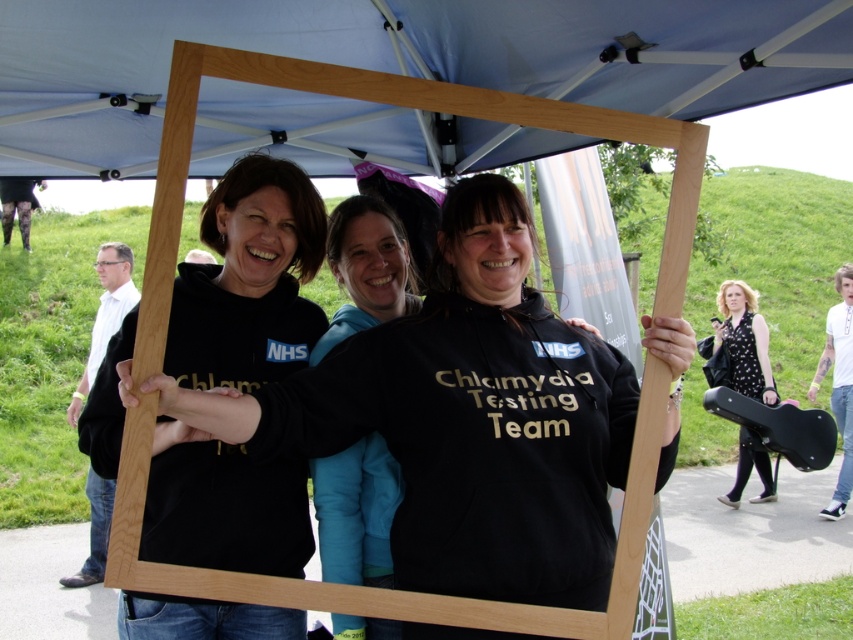
Who is positioned more to the left, matte black hoodie at center or black matte sweatshirt at center?

matte black hoodie at center

Does matte black hoodie at center have a larger size compared to black matte sweatshirt at center?

Yes.

Is point (189, 387) more distant than point (347, 580)?

That is False.

Where is `matte black hoodie at center`? matte black hoodie at center is located at coordinates (248, 280).

Is point (271, 564) positioned in front of point (747, 307)?

That is True.

Identify the location of matte black hoodie at center. The image size is (853, 640). (248, 280).

Image resolution: width=853 pixels, height=640 pixels. What are the coordinates of `matte black hoodie at center` in the screenshot? It's located at (248, 280).

Does point (91, 3) lie in front of point (402, 275)?

Yes, point (91, 3) is closer to viewer.

Does point (659, 60) lie in front of point (374, 228)?

That is True.

The image size is (853, 640). I want to click on blue fabric canopy at upper center, so click(x=397, y=58).